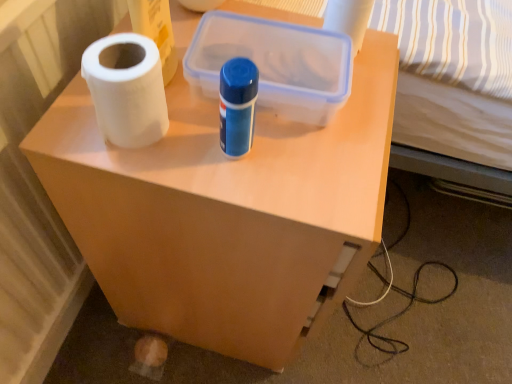
I want to click on vacant space in front of transparent plastic storage box at center, so click(x=263, y=175).